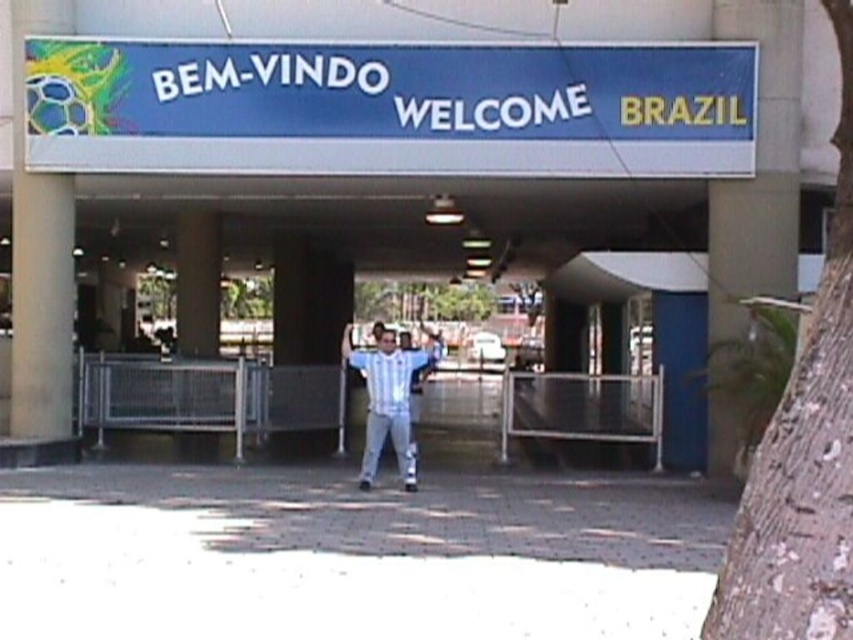
Can you confirm if smooth concrete pillar at upper left is shorter than white fabric shirt at center?

Yes.

Is smooth concrete pillar at upper left positioned before white fabric shirt at center?

No, smooth concrete pillar at upper left is further to the viewer.

Who is more forward, (39, 355) or (405, 452)?

Point (405, 452)

Find the location of `smooth concrete pillar at upper left`. smooth concrete pillar at upper left is located at coordinates (39, 257).

Does blue glossy sign at upper center have a greater width compared to smooth concrete pillar at upper left?

Yes, blue glossy sign at upper center is wider than smooth concrete pillar at upper left.

Does blue glossy sign at upper center come in front of smooth concrete pillar at upper left?

Yes.

What are the coordinates of `blue glossy sign at upper center` in the screenshot? It's located at (415, 147).

I want to click on blue glossy sign at upper center, so click(x=415, y=147).

Is gray concrete pillar at upper right above smooth concrete pillar at upper left?

No, gray concrete pillar at upper right is not above smooth concrete pillar at upper left.

Which is more to the right, gray concrete pillar at upper right or smooth concrete pillar at upper left?

gray concrete pillar at upper right is more to the right.

Who is more forward, (766,148) or (15,108)?

Point (766,148) is in front.

This screenshot has width=853, height=640. I want to click on gray concrete pillar at upper right, so click(758, 170).